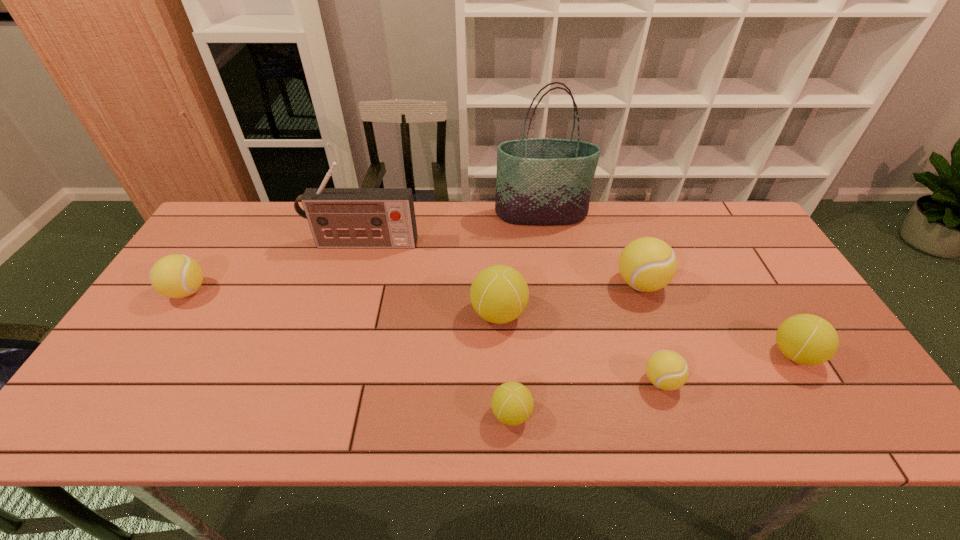
Locate an element on the screen. The image size is (960, 540). tote bag that is at the far edge is located at coordinates (541, 181).

Identify the location of radio receiver that is at the far edge. The height and width of the screenshot is (540, 960). (338, 217).

Find the location of a particular element. This screenshot has width=960, height=540. object that is at the left edge is located at coordinates (175, 276).

The image size is (960, 540). I want to click on object that is positioned at the right edge, so click(806, 339).

At what (x,y) coordinates should I click in order to perform the action: click on vacant region at the far edge of the desktop. Please return your answer as a coordinate pair (x, y). The width and height of the screenshot is (960, 540). Looking at the image, I should click on (303, 241).

Find the location of a particular element. Image resolution: width=960 pixels, height=540 pixels. vacant space at the near edge is located at coordinates (686, 434).

I want to click on vacant area at the left edge of the desktop, so click(x=181, y=302).

In the image, there is a desktop. At what (x,y) coordinates should I click in order to perform the action: click on blank space at the right edge. Please return your answer as a coordinate pair (x, y). Looking at the image, I should click on (780, 293).

Locate an element on the screen. empty location between the green tote bag and the smallest yellow tennis ball is located at coordinates (601, 298).

I want to click on free spot between the nearest yellow tennis ball and the leftmost object, so click(x=424, y=336).